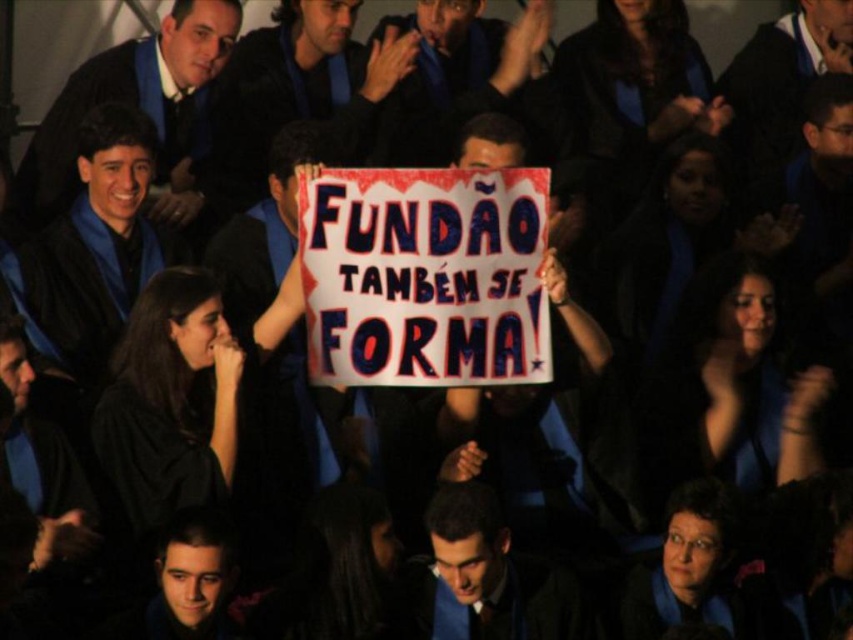
Which of these two, matte black graduation gown at left or matte blue suit at center, stands shorter?

With less height is matte blue suit at center.

This screenshot has width=853, height=640. I want to click on matte black graduation gown at left, so click(97, 243).

Is matte black graduation gown at left bigger than matte black graduation gown at upper center?

Incorrect, matte black graduation gown at left is not larger than matte black graduation gown at upper center.

Who is shorter, matte black graduation gown at left or matte black graduation gown at upper center?

Standing shorter between the two is matte black graduation gown at upper center.

The width and height of the screenshot is (853, 640). Find the location of `matte black graduation gown at left`. matte black graduation gown at left is located at coordinates (97, 243).

Consider the image. Does matte black graduation gown at upper center lie in front of matte blue suit at center?

No.

Looking at this image, measure the distance between point (463, 72) and camera.

Point (463, 72) is 24.33 meters away from camera.

Does point (415, 44) come behind point (579, 632)?

That is True.

Where is `matte black graduation gown at upper center`? matte black graduation gown at upper center is located at coordinates (451, 74).